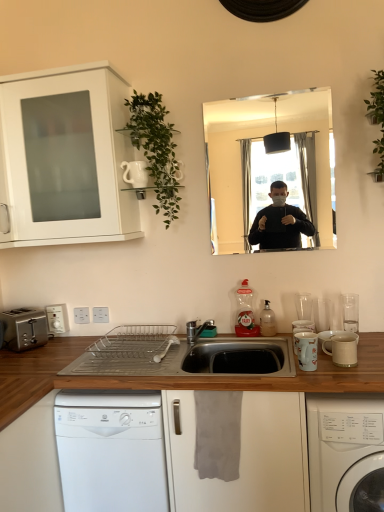
I want to click on free space to the left of translucent plastic soap dispenser at sink, which is the 2th bottle from left to right, so click(241, 338).